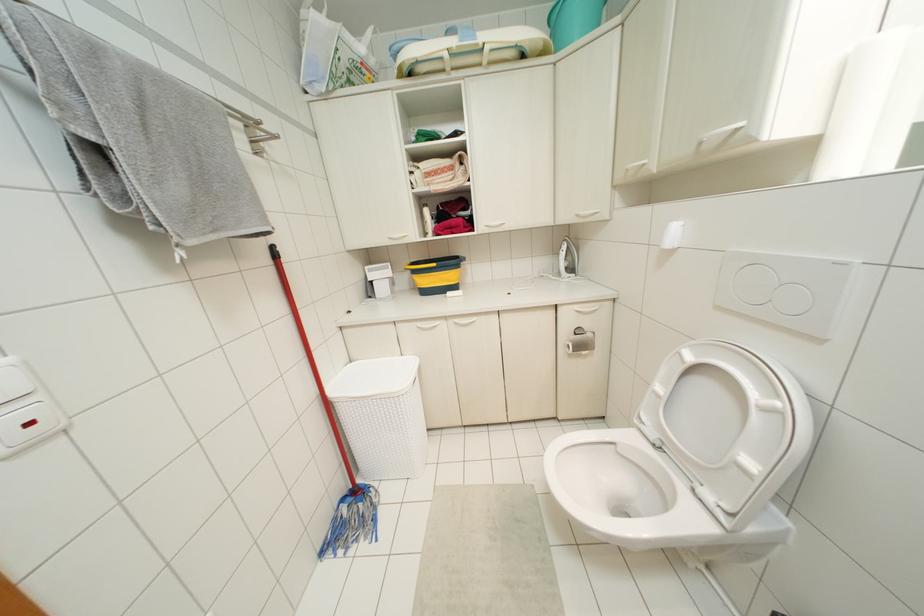
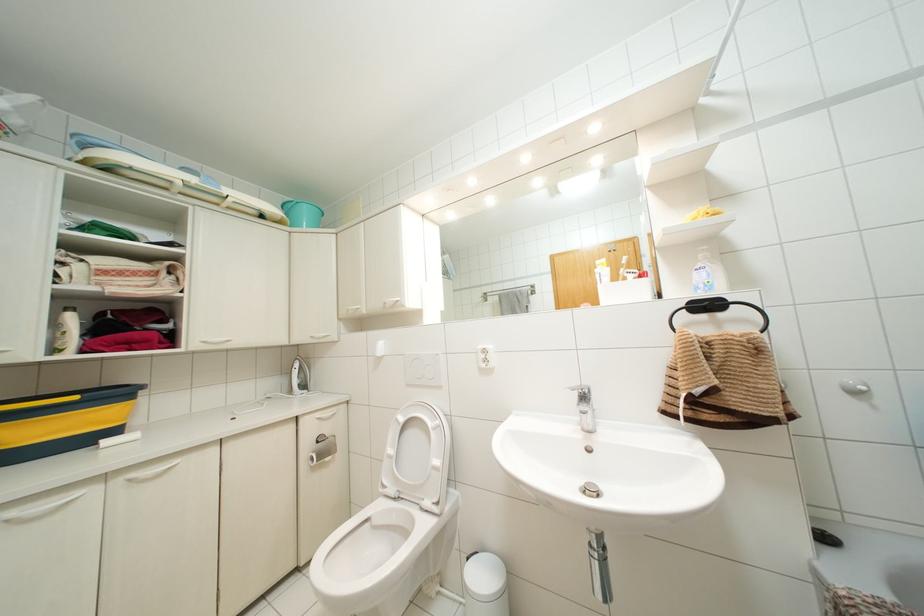
How did the camera likely rotate?

The camera's rotation is toward right-up.